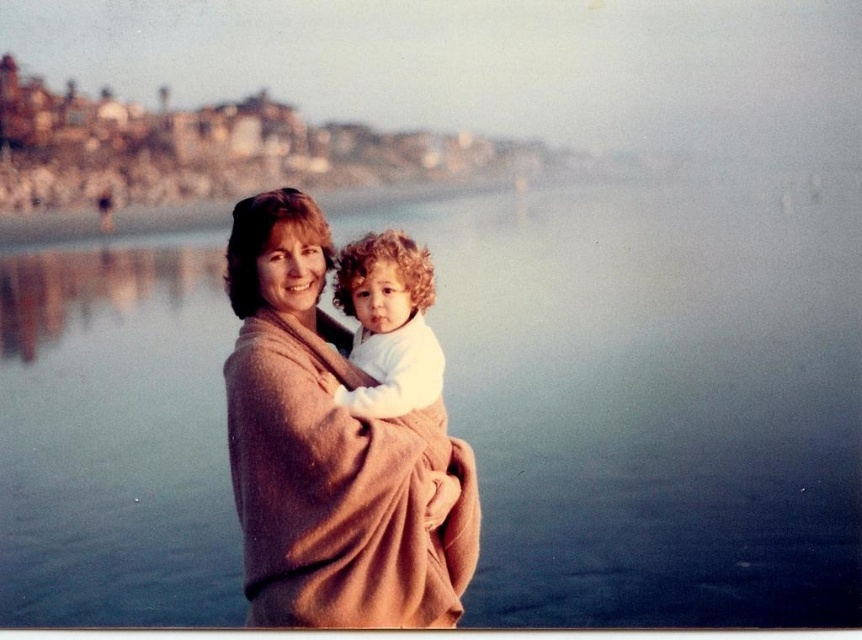
Question: Does beige wool sweater at center have a greater width compared to white soft fabric at center?

Choices:
 (A) no
 (B) yes

Answer: (B)

Question: Does blue water at center have a larger size compared to beige wool sweater at center?

Choices:
 (A) yes
 (B) no

Answer: (A)

Question: Is beige wool sweater at center bigger than white soft fabric at center?

Choices:
 (A) no
 (B) yes

Answer: (B)

Question: Which point appears farthest from the camera in this image?

Choices:
 (A) (661, 301)
 (B) (420, 390)

Answer: (A)

Question: Based on their relative distances, which object is nearer to the white soft fabric at center?

Choices:
 (A) blue water at center
 (B) beige wool sweater at center

Answer: (B)

Question: Considering the real-world distances, which object is farthest from the beige wool sweater at center?

Choices:
 (A) blue water at center
 (B) white soft fabric at center

Answer: (A)